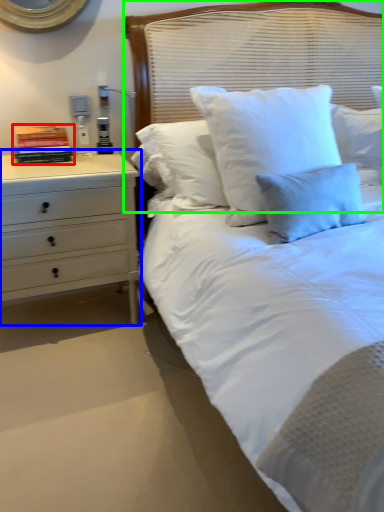
Question: Which object is positioned closest to book (highlighted by a red box)? Select from chest of drawers (highlighted by a blue box) and headboard (highlighted by a green box).

Choices:
 (A) chest of drawers
 (B) headboard

Answer: (A)